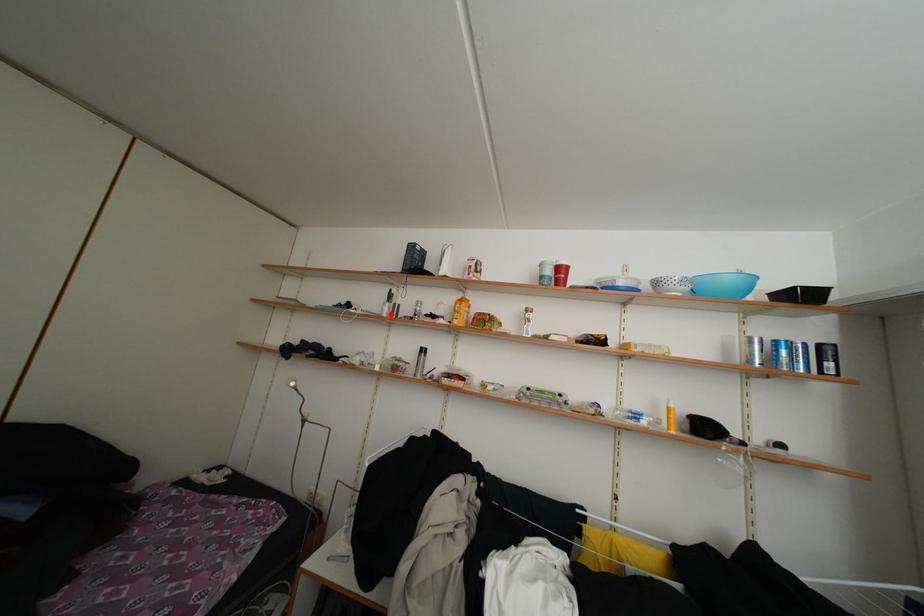
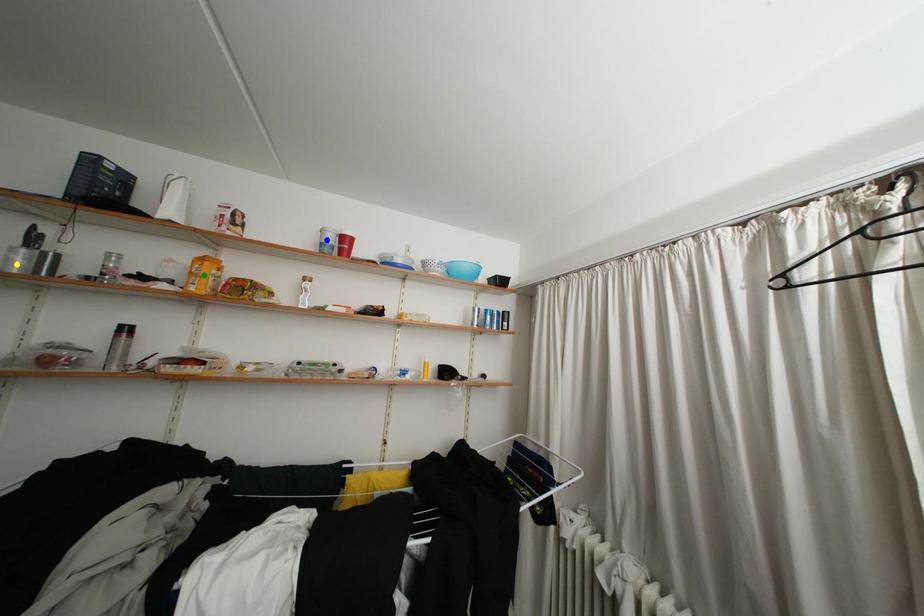
Question: I am providing you with two images of the same scene from different viewpoints. A red point is marked on the first image. You are given multiple points on the second image. Can you choose the point in image 2 that corresponds to the point in image 1?

Choices:
 (A) blue point
 (B) yellow point
 (C) green point

Answer: (B)